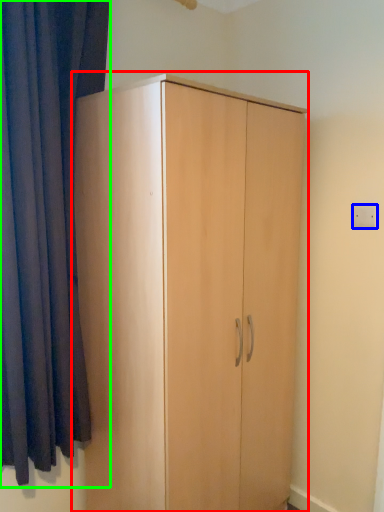
Question: Which object is positioned closest to cupboard (highlighted by a red box)? Select from electric outlet (highlighted by a blue box) and curtain (highlighted by a green box).

Choices:
 (A) electric outlet
 (B) curtain

Answer: (B)